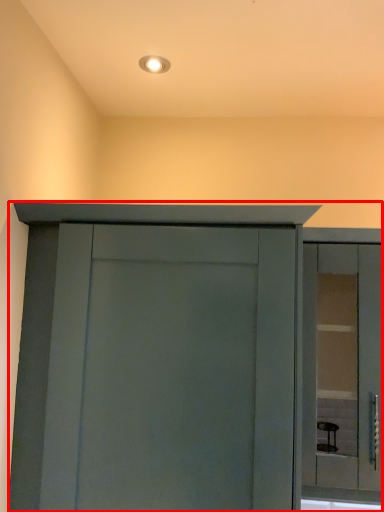
Question: In this image, where is cupboard (annotated by the red box) located relative to window?

Choices:
 (A) left
 (B) right

Answer: (A)